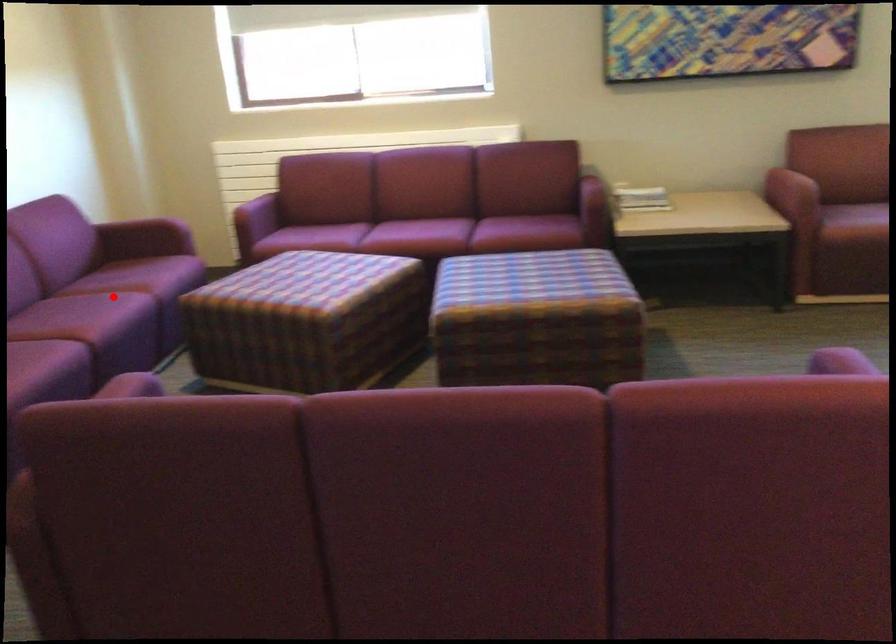
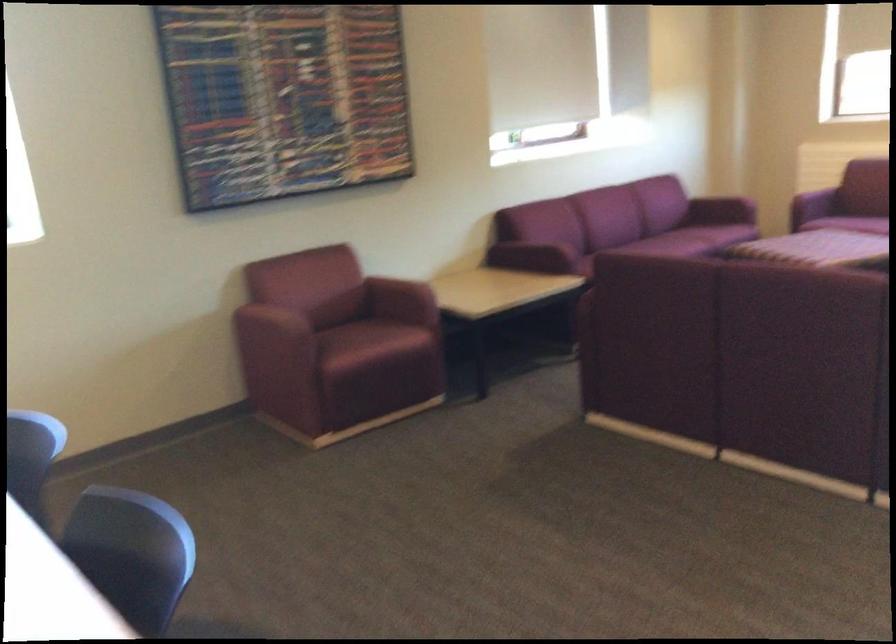
Question: I am providing you with two images of the same scene from different viewpoints. In image1, a red point is highlighted. Considering the same 3D point in image2, which of the following is correct?

Choices:
 (A) It is closer
 (B) It is farther

Answer: (B)